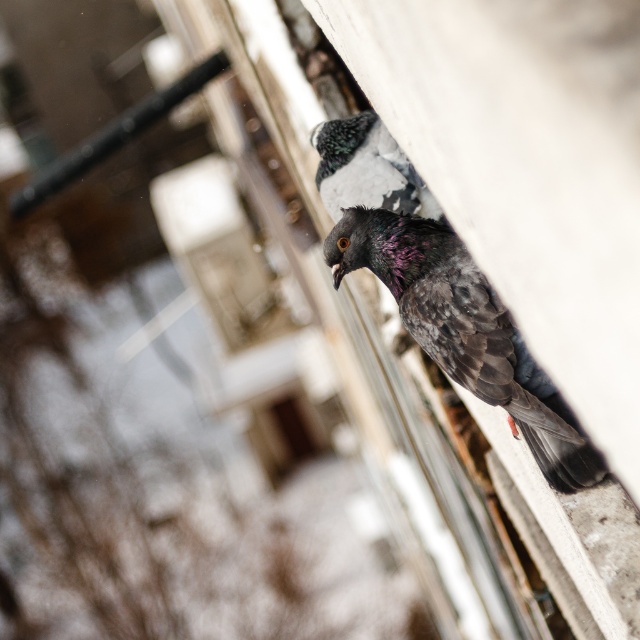
Who is more distant from viewer, (486,310) or (394,177)?

Positioned behind is point (394,177).

Is the position of shiny dark gray pigeon at upper right less distant than that of speckled feather pigeon at upper center?

Yes, it is in front of speckled feather pigeon at upper center.

At what (x,y) coordinates should I click in order to perform the action: click on shiny dark gray pigeon at upper right. Please return your answer as a coordinate pair (x, y). Image resolution: width=640 pixels, height=640 pixels. Looking at the image, I should click on (465, 330).